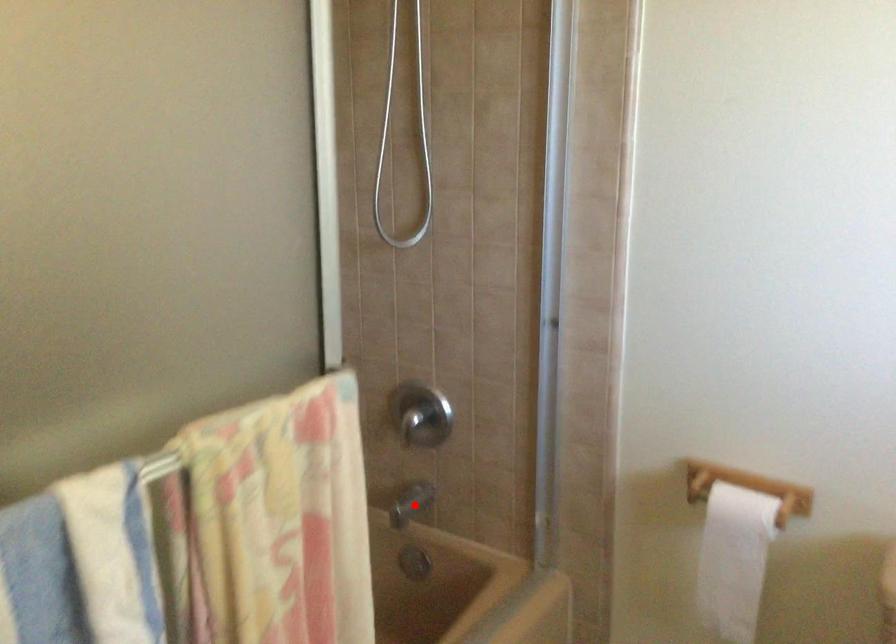
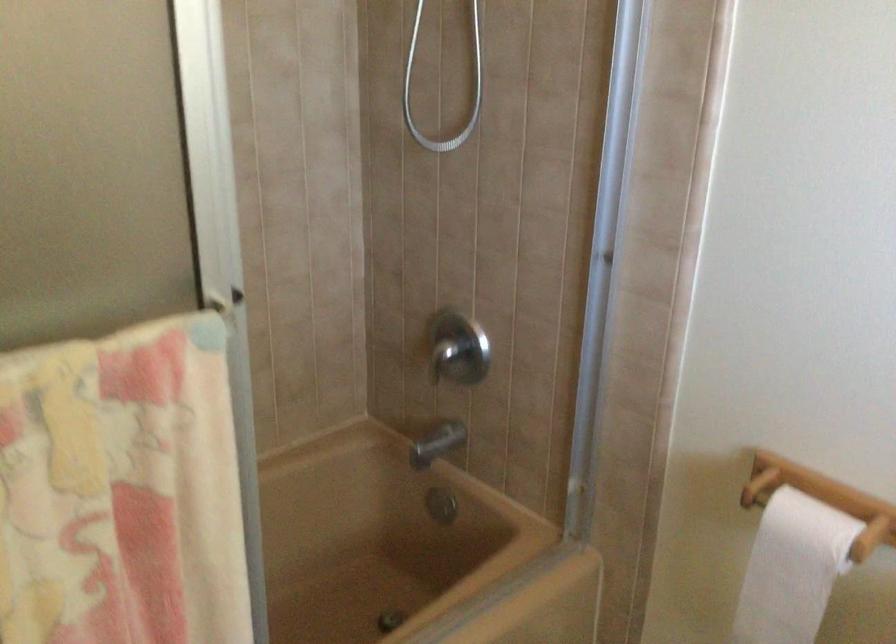
Question: I am providing you with two images of the same scene from different viewpoints. Given a red point in image1, look at the same physical point in image2. Is it:

Choices:
 (A) Closer to the viewpoint
 (B) Farther from the viewpoint

Answer: (A)